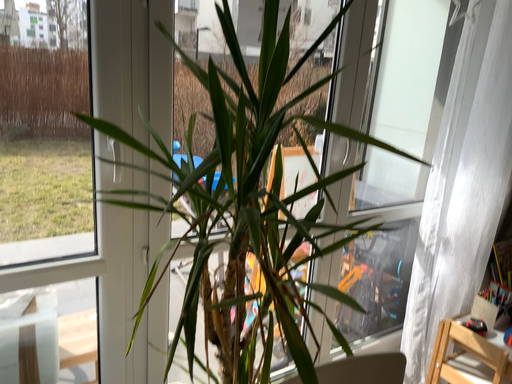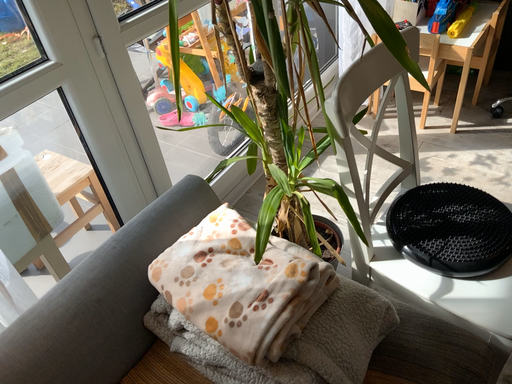
Question: Which way did the camera rotate in the video?

Choices:
 (A) rotated downward
 (B) rotated upward

Answer: (A)